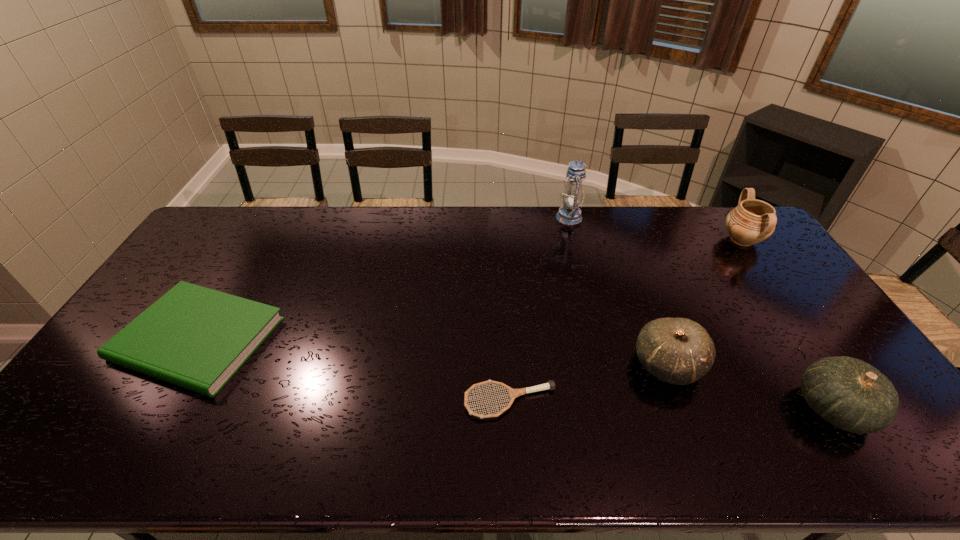
The image size is (960, 540). What are the coordinates of `vacant area in the image that satisfies the following two spatial constraints: 1. on the front-facing side of the right gourd; 2. on the right side of the tallest object` in the screenshot? It's located at (617, 408).

Find the location of a particular element. free region that satisfies the following two spatial constraints: 1. on the front-facing side of the lantern; 2. on the front side of the leftmost object is located at coordinates (600, 339).

What are the coordinates of `free point that satisfies the following two spatial constraints: 1. on the back side of the right gourd; 2. on the front-facing side of the tallest object` in the screenshot? It's located at coord(710,217).

Image resolution: width=960 pixels, height=540 pixels. Find the location of `vacant space that satisfies the following two spatial constraints: 1. on the front-facing side of the left gourd; 2. on the right side of the lantern`. vacant space that satisfies the following two spatial constraints: 1. on the front-facing side of the left gourd; 2. on the right side of the lantern is located at coordinates (606, 364).

I want to click on vacant space that satisfies the following two spatial constraints: 1. on the back side of the shortest object; 2. on the left side of the left gourd, so (x=509, y=364).

At what (x,y) coordinates should I click in order to perform the action: click on vacant area in the image that satisfies the following two spatial constraints: 1. on the front side of the fourth object from left to right; 2. on the right side of the right gourd. Please return your answer as a coordinate pair (x, y). Looking at the image, I should click on (684, 408).

You are a GUI agent. You are given a task and a screenshot of the screen. Output one action in this format:
    pyautogui.click(x=<x>, y=<y>)
    Task: Click on the free location that satisfies the following two spatial constraints: 1. on the front-facing side of the urn; 2. on the front side of the leftmost object
    The width and height of the screenshot is (960, 540).
    Given the screenshot: What is the action you would take?
    811,339